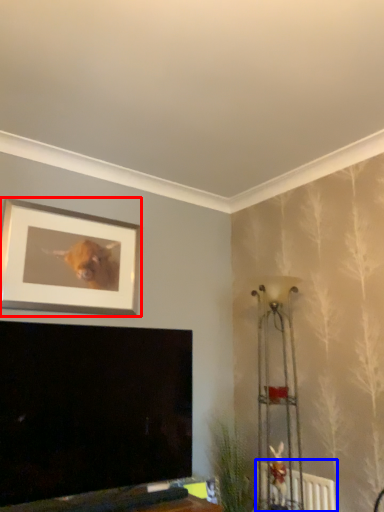
Question: Which of the following is the closest to the observer, picture frame (highlighted by a red box) or radiator (highlighted by a blue box)?

Choices:
 (A) picture frame
 (B) radiator

Answer: (B)